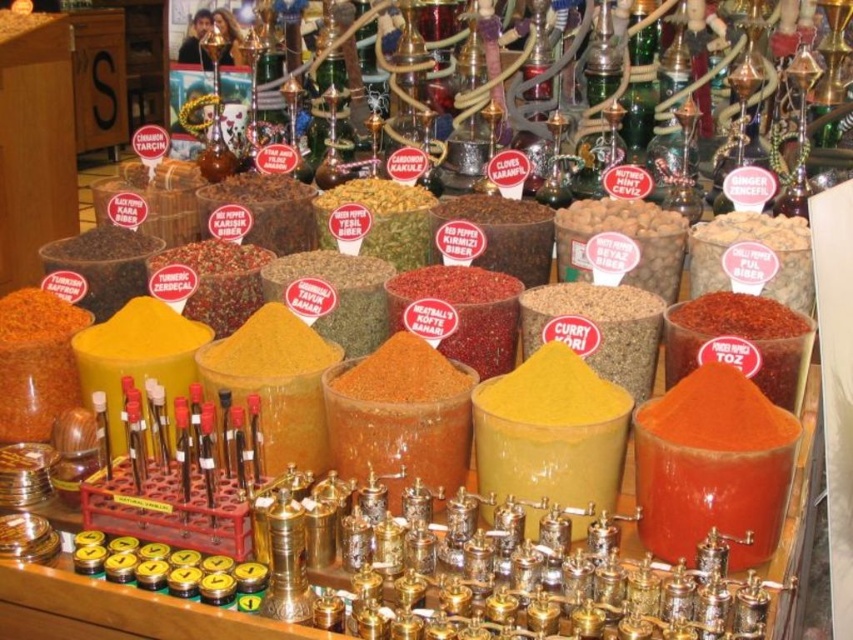
You are a chef preparing a dish that requires both the bright red powder at center and the dark red pepper at center. You need to grind them using the manual grinders provided. Which spice container should you use first if you want to start with the thinner ingredient?

You should start with the bright red powder at center because it is thinner than the dark red pepper at center, making it easier to grind first.

You are a chef preparing a dish and need to choose between the brown granular curry at center and the dark red pepper at center based on their height. Which container is taller?

The brown granular curry at center is taller than the dark red pepper at center.

You are a chef preparing a dish and need to choose between the brown granular curry at center and the dark red pepper at center. Which one has a smaller width?

The brown granular curry at center has a smaller width than the dark red pepper at center.